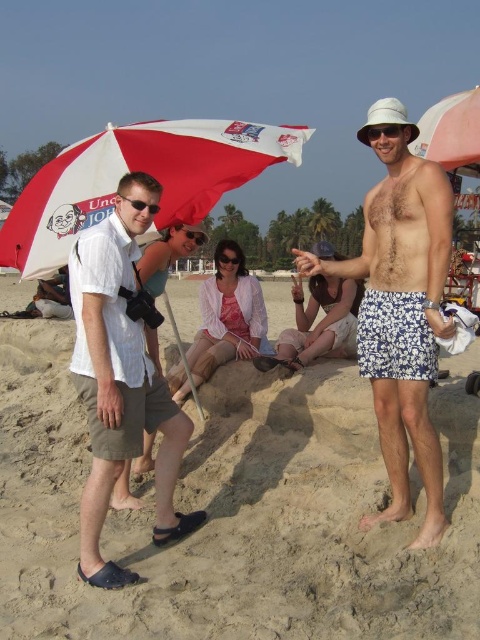
Question: Which point appears closest to the camera in this image?

Choices:
 (A) (197, 225)
 (B) (396, 163)
 (C) (228, 248)

Answer: (B)

Question: Estimate the real-world distances between objects in this image. Which object is closer to the white cotton shirt at left?

Choices:
 (A) white matte bucket hat at upper center
 (B) clear plastic goggles at center

Answer: (B)

Question: Does white fabric umbrella at upper right appear on the left side of clear plastic goggles at center?

Choices:
 (A) no
 (B) yes

Answer: (A)

Question: Does red and white fabric umbrella at upper left lie behind light pink fabric at center?

Choices:
 (A) yes
 (B) no

Answer: (B)

Question: Which object is closer to the camera taking this photo?

Choices:
 (A) white matte bucket hat at upper center
 (B) white floral shorts at center
 (C) red and white fabric umbrella at upper left
 (D) white cotton shirt at left

Answer: (D)

Question: Does red and white fabric umbrella at upper left appear on the left side of white fabric umbrella at upper right?

Choices:
 (A) yes
 (B) no

Answer: (A)